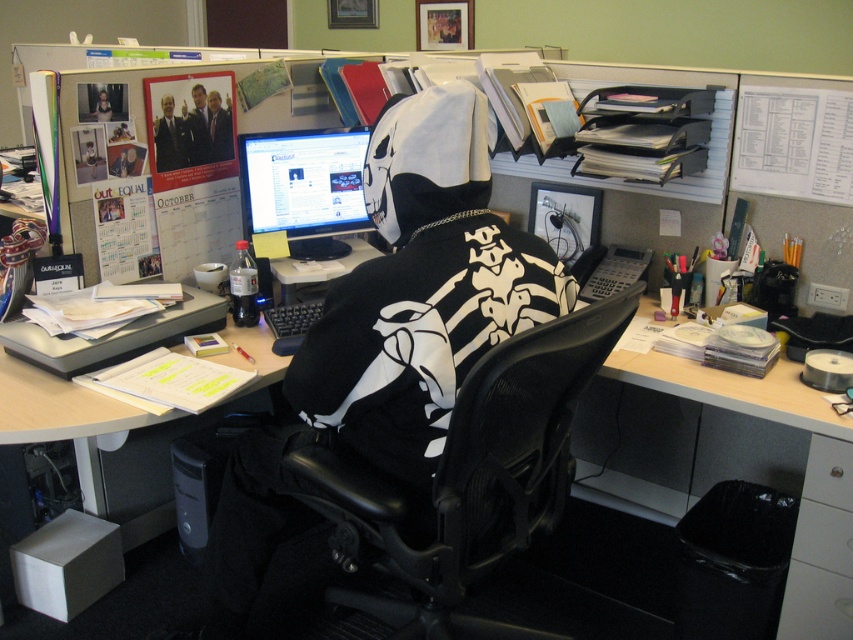
Question: Which of the following is the farthest from the observer?

Choices:
 (A) (849, 620)
 (B) (842, 512)

Answer: (A)

Question: Is white plastic drawer at lower right to the right of metallic silver drawer at lower right from the viewer's perspective?

Choices:
 (A) no
 (B) yes

Answer: (B)

Question: Estimate the real-world distances between objects in this image. Which object is closer to the black mesh office chair at center?

Choices:
 (A) matte black monitor at center
 (B) metallic silver drawer at lower right

Answer: (B)

Question: Which of the following is the farthest from the observer?

Choices:
 (A) metallic silver drawer at lower right
 (B) white plastic drawer at lower right
 (C) black mesh swivel chair at center
 (D) black mesh office chair at center

Answer: (B)

Question: Is black mesh swivel chair at center wider than black mesh office chair at center?

Choices:
 (A) yes
 (B) no

Answer: (A)

Question: Does black mesh office chair at center appear on the left side of white plastic drawer at lower right?

Choices:
 (A) yes
 (B) no

Answer: (A)